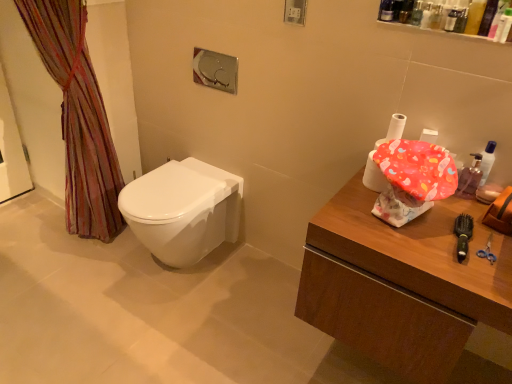
The height and width of the screenshot is (384, 512). What are the coordinates of `free space in front of white glossy toilet at center` in the screenshot? It's located at (161, 327).